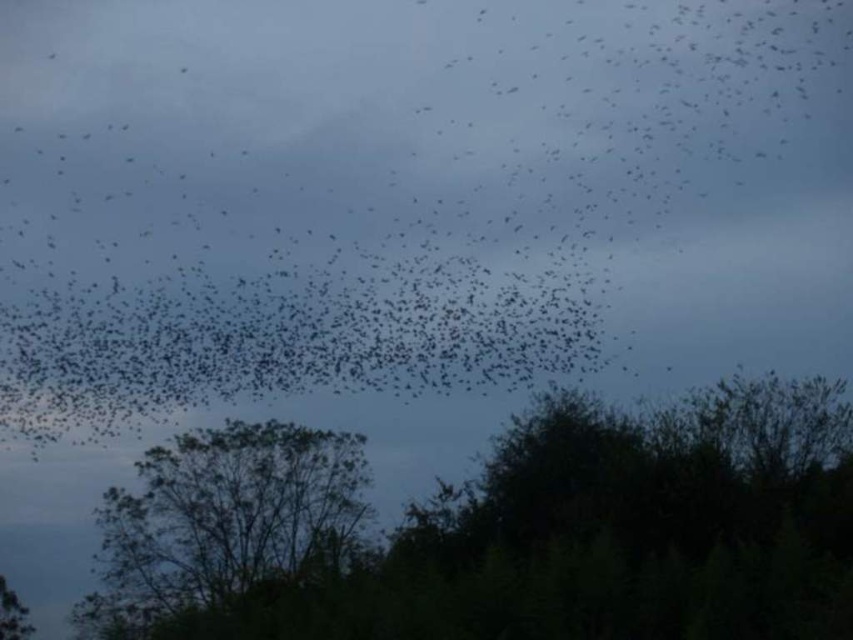
Is black matte birds at upper center smaller than green leafy tree at center?

Actually, black matte birds at upper center might be larger than green leafy tree at center.

Can you confirm if black matte birds at upper center is wider than green leafy tree at center?

Yes, black matte birds at upper center is wider than green leafy tree at center.

Does point (292, 141) come farther from viewer compared to point (256, 429)?

Yes, point (292, 141) is farther from viewer.

Where is `black matte birds at upper center`? The image size is (853, 640). black matte birds at upper center is located at coordinates (384, 216).

Between point (512, 481) and point (105, 531), which one is positioned behind?

The point (105, 531) is more distant.

Is green leafy tree at lower center above green leafy tree at center?

Indeed, green leafy tree at lower center is positioned over green leafy tree at center.

Image resolution: width=853 pixels, height=640 pixels. What are the coordinates of `green leafy tree at lower center` in the screenshot? It's located at (538, 536).

Which is behind, point (85, 148) or point (161, 476)?

Point (85, 148)

Can you confirm if black matte birds at upper center is positioned to the right of green leafy tree at lower center?

No, black matte birds at upper center is not to the right of green leafy tree at lower center.

Does point (351, 333) come in front of point (496, 621)?

No, (351, 333) is further to viewer.

The width and height of the screenshot is (853, 640). In order to click on black matte birds at upper center in this screenshot , I will do `click(384, 216)`.